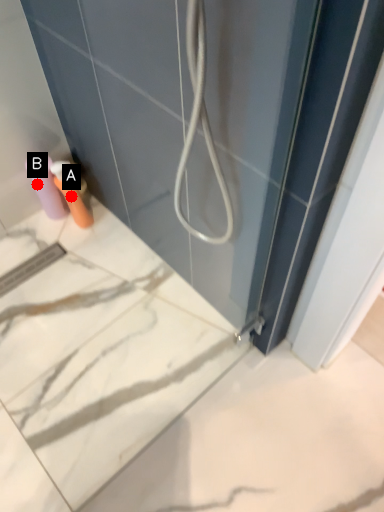
Question: Two points are circled on the image, labeled by A and B beside each circle. Which point is closer to the camera?

Choices:
 (A) A is closer
 (B) B is closer

Answer: (A)